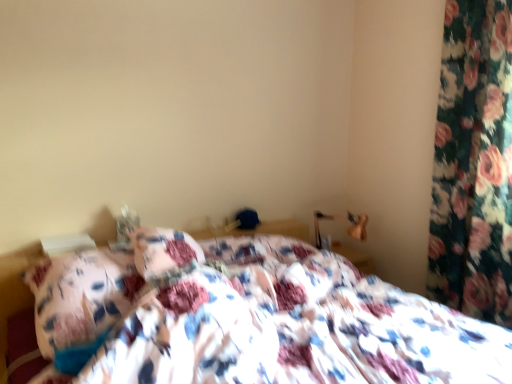
Question: Is floral fabric curtain at right smaller than floral fabric bed at center?

Choices:
 (A) yes
 (B) no

Answer: (A)

Question: Is floral fabric curtain at right behind floral fabric bed at center?

Choices:
 (A) no
 (B) yes

Answer: (B)

Question: Can you confirm if floral fabric curtain at right is shorter than floral fabric bed at center?

Choices:
 (A) yes
 (B) no

Answer: (B)

Question: From a real-world perspective, is floral fabric curtain at right positioned over floral fabric bed at center based on gravity?

Choices:
 (A) no
 (B) yes

Answer: (B)

Question: From the image's perspective, would you say floral fabric curtain at right is positioned over floral fabric bed at center?

Choices:
 (A) yes
 (B) no

Answer: (A)

Question: Is floral fabric curtain at right taller than floral fabric bed at center?

Choices:
 (A) no
 (B) yes

Answer: (B)

Question: Does floral fabric bed at center lie behind floral fabric curtain at right?

Choices:
 (A) no
 (B) yes

Answer: (A)

Question: Is floral fabric bed at center smaller than floral fabric curtain at right?

Choices:
 (A) yes
 (B) no

Answer: (B)

Question: Is floral fabric bed at center touching floral fabric curtain at right?

Choices:
 (A) no
 (B) yes

Answer: (A)

Question: Can you confirm if floral fabric bed at center is shorter than floral fabric curtain at right?

Choices:
 (A) yes
 (B) no

Answer: (A)

Question: Is floral fabric bed at center to the left of floral fabric curtain at right from the viewer's perspective?

Choices:
 (A) no
 (B) yes

Answer: (B)

Question: From the image's perspective, would you say floral fabric bed at center is shown under floral fabric curtain at right?

Choices:
 (A) yes
 (B) no

Answer: (A)

Question: In terms of size, does floral fabric bed at center appear bigger or smaller than floral fabric curtain at right?

Choices:
 (A) big
 (B) small

Answer: (A)